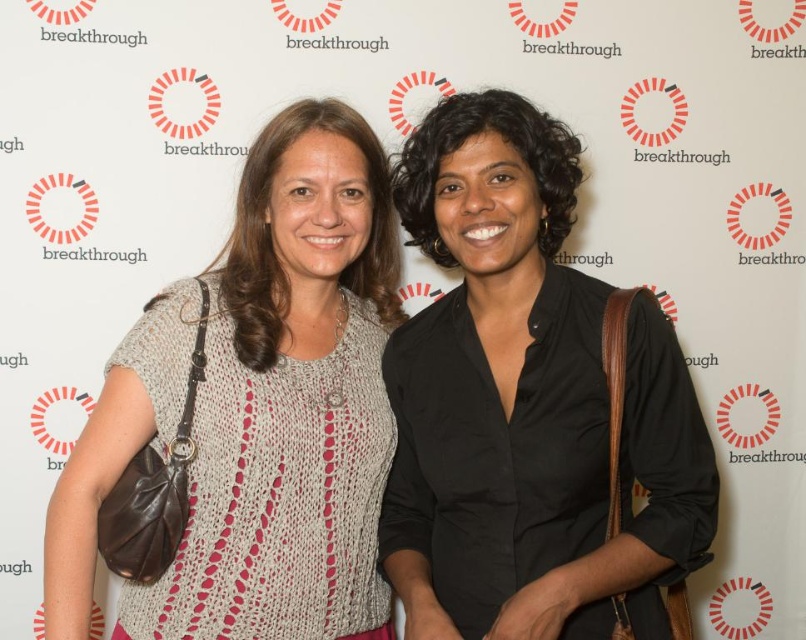
Which is more to the right, black matte shirt at center or knitted beige sweater at center?

black matte shirt at center

Is black matte shirt at center to the left of knitted beige sweater at center from the viewer's perspective?

Incorrect, black matte shirt at center is not on the left side of knitted beige sweater at center.

Between point (480, 509) and point (372, 609), which one is positioned in front?

Point (480, 509) is in front.

The height and width of the screenshot is (640, 806). I want to click on black matte shirt at center, so click(530, 404).